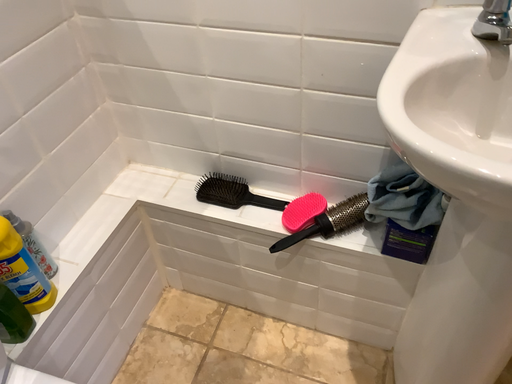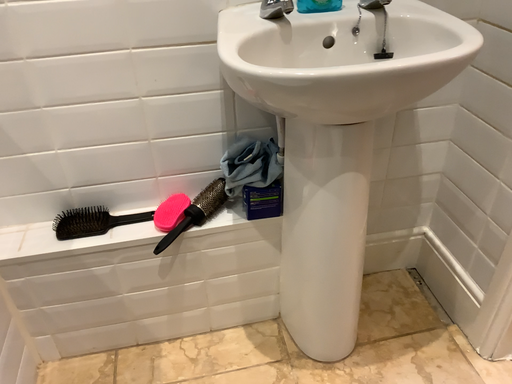
Question: How did the camera likely rotate when shooting the video?

Choices:
 (A) rotated downward
 (B) rotated upward

Answer: (B)